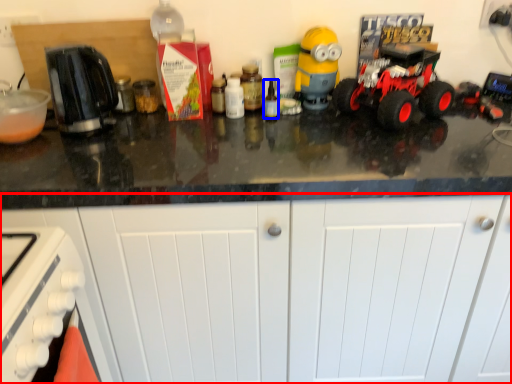
Question: Among these objects, which one is nearest to the camera, cabinetry (highlighted by a red box) or bottle (highlighted by a blue box)?

Choices:
 (A) cabinetry
 (B) bottle

Answer: (A)